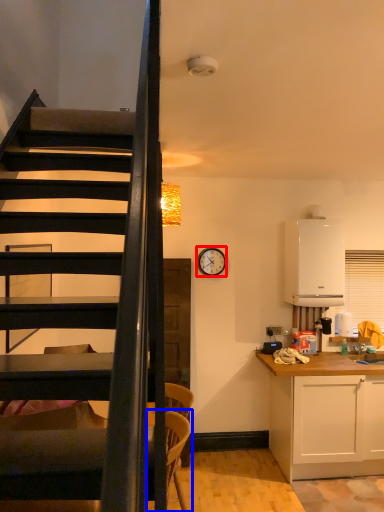
Question: Which object is further to the camera taking this photo, clock (highlighted by a red box) or armchair (highlighted by a blue box)?

Choices:
 (A) clock
 (B) armchair

Answer: (A)